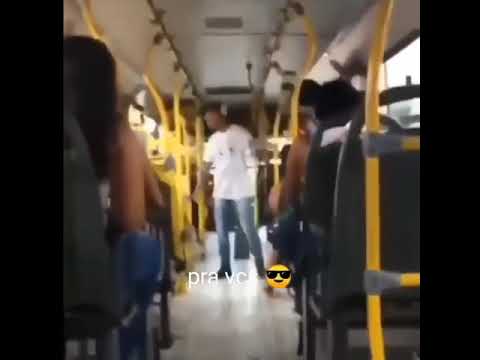
In order to click on vent in this screenshot , I will do `click(228, 23)`.